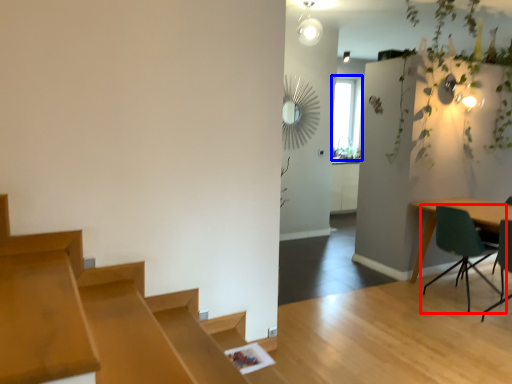
Question: Which object is closer to the camera taking this photo, chair (highlighted by a red box) or window (highlighted by a blue box)?

Choices:
 (A) chair
 (B) window

Answer: (A)